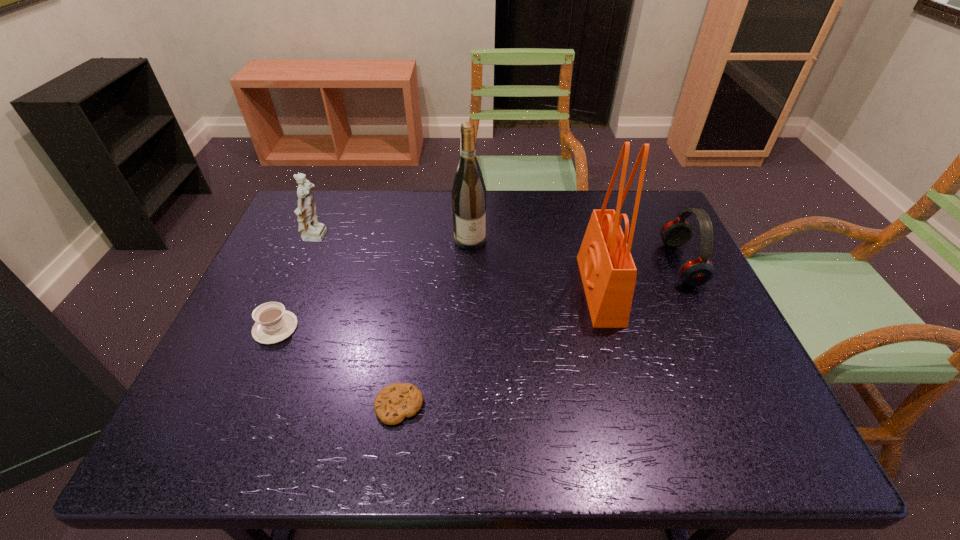
Find the location of a particular element. The width and height of the screenshot is (960, 540). vacant position at the far left corner of the desktop is located at coordinates (313, 191).

You are a GUI agent. You are given a task and a screenshot of the screen. Output one action in this format:
    pyautogui.click(x=<x>, y=<y>)
    Task: Click on the free space at the near left corner of the desktop
    
    Given the screenshot: What is the action you would take?
    pyautogui.click(x=178, y=427)

The height and width of the screenshot is (540, 960). I want to click on vacant space at the far right corner of the desktop, so click(x=660, y=230).

Where is `vacant region between the fifth tallest object and the fourth shortest object`? The image size is (960, 540). vacant region between the fifth tallest object and the fourth shortest object is located at coordinates (297, 283).

Identify the location of vacant area that lies between the third tallest object and the fifth shortest object. Image resolution: width=960 pixels, height=540 pixels. (394, 239).

The width and height of the screenshot is (960, 540). I want to click on free area in between the teacup and the tote bag, so click(x=438, y=309).

At what (x,y) coordinates should I click in order to perform the action: click on free spot between the figurine and the wine bottle. Please return your answer as a coordinate pair (x, y). Looking at the image, I should click on (394, 239).

Image resolution: width=960 pixels, height=540 pixels. I want to click on free space that is in between the figurine and the tote bag, so click(459, 264).

The width and height of the screenshot is (960, 540). In order to click on free point between the fifth object from left to right and the earphone in this screenshot , I will do `click(640, 277)`.

This screenshot has width=960, height=540. Identify the location of free point between the fourth shortest object and the nearest object. (358, 322).